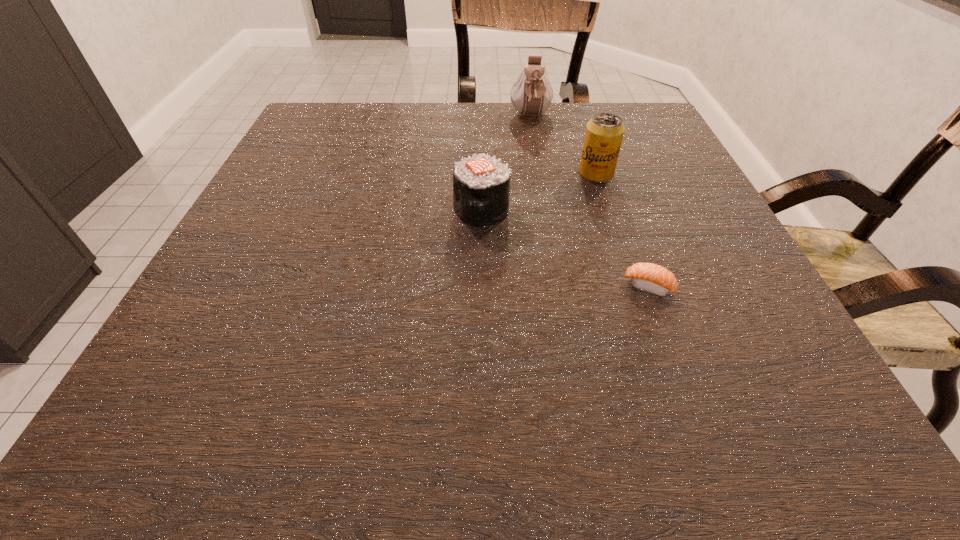
At what (x,y) coordinates should I click in order to perform the action: click on pouch. Please return your answer as a coordinate pair (x, y). This screenshot has width=960, height=540. Looking at the image, I should click on (532, 93).

You are a GUI agent. You are given a task and a screenshot of the screen. Output one action in this format:
    pyautogui.click(x=<x>, y=<y>)
    Task: Click on the farthest object
    
    Given the screenshot: What is the action you would take?
    pyautogui.click(x=532, y=93)

This screenshot has height=540, width=960. Identify the location of beer can. (604, 133).

The image size is (960, 540). In order to click on the second shortest object in this screenshot , I will do `click(481, 185)`.

You are a GUI agent. You are given a task and a screenshot of the screen. Output one action in this format:
    pyautogui.click(x=<x>, y=<y>)
    Task: Click on the farther sushi
    The image size is (960, 540).
    Given the screenshot: What is the action you would take?
    pyautogui.click(x=481, y=185)

Find the location of a particular element. the shortest object is located at coordinates (649, 277).

Where is `the nearest object`? The height and width of the screenshot is (540, 960). the nearest object is located at coordinates (649, 277).

Find the location of a particular element. The image size is (960, 540). blank space located 0.200m on the front-facing side of the farthest object is located at coordinates (540, 173).

This screenshot has height=540, width=960. In order to click on vacant space located 0.270m on the front of the third nearest object in this screenshot , I will do `click(630, 276)`.

This screenshot has height=540, width=960. What are the coordinates of `vacant space located 0.170m on the right of the left sushi` in the screenshot? It's located at (597, 210).